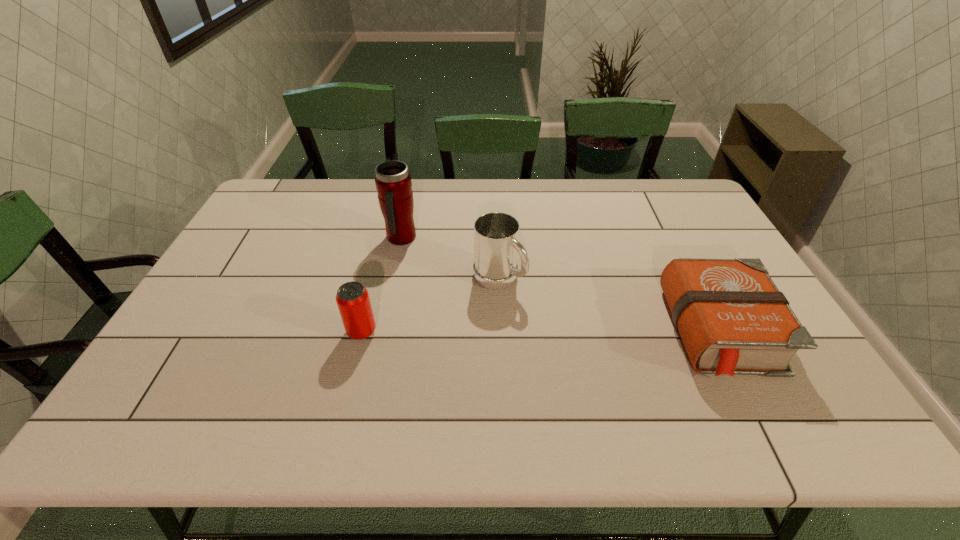
I want to click on free space between the mug and the shortest object, so click(612, 305).

Where is `free point between the mug and the third tallest object`? free point between the mug and the third tallest object is located at coordinates (430, 305).

Point out which object is positioned as the second nearest to the can. Please provide its 2D coordinates. Your answer should be formatted as a tuple, i.e. [(x, y)], where the tuple contains the x and y coordinates of a point satisfying the conditions above.

[(393, 182)]

Identify the location of object that is the second closest to the third object from left to right. The image size is (960, 540). (352, 298).

Find the location of a particular element. The width and height of the screenshot is (960, 540). free space that satisfies the following two spatial constraints: 1. on the front side of the rightmost object; 2. on the right side of the second shortest object is located at coordinates (362, 332).